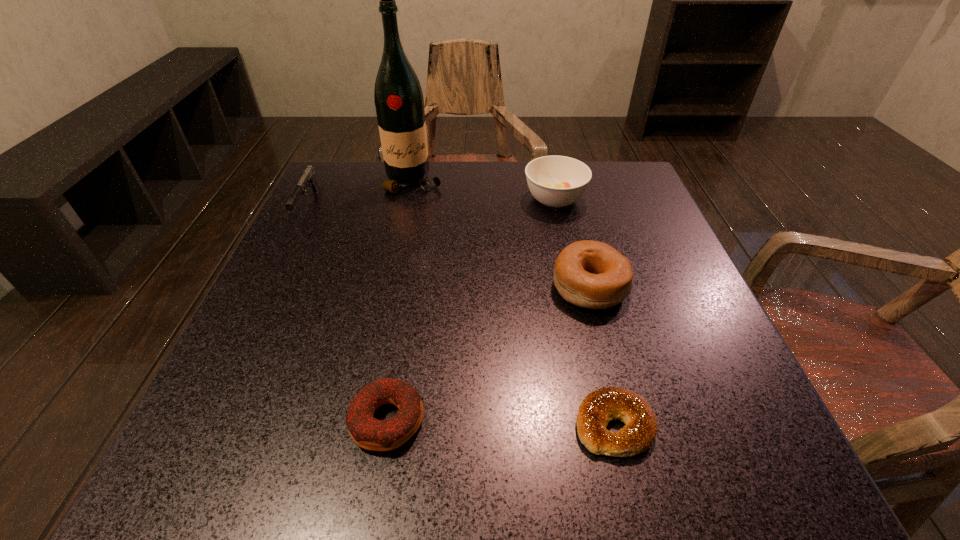
The image size is (960, 540). In order to click on free location located 0.360m at the muzzle end of the leftmost object in this screenshot , I will do `click(227, 369)`.

The width and height of the screenshot is (960, 540). Find the location of `vacant region located 0.400m on the back of the fourth farthest object`. vacant region located 0.400m on the back of the fourth farthest object is located at coordinates (558, 162).

At what (x,y) coordinates should I click in order to perform the action: click on free space located 0.320m on the back of the fifth tallest object. Please return your answer as a coordinate pair (x, y). Looking at the image, I should click on (416, 252).

Find the location of `free space located on the back of the shorter bagel`. free space located on the back of the shorter bagel is located at coordinates (597, 355).

I want to click on wine bottle that is at the far edge, so click(x=399, y=102).

This screenshot has width=960, height=540. In order to click on soup bowl that is at the far edge in this screenshot , I will do `click(556, 181)`.

Image resolution: width=960 pixels, height=540 pixels. I want to click on gun located at the far edge, so click(308, 177).

The image size is (960, 540). I want to click on doughnut that is at the near edge, so click(x=369, y=433).

I want to click on bagel present at the near edge, so click(x=598, y=408).

Identify the location of object that is at the left edge. (308, 177).